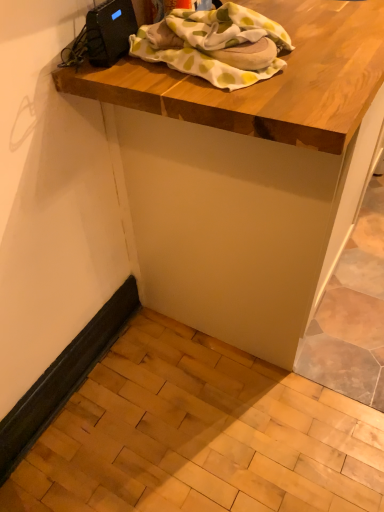
Identify the location of free space in front of white cotton blanket at upper center. (269, 92).